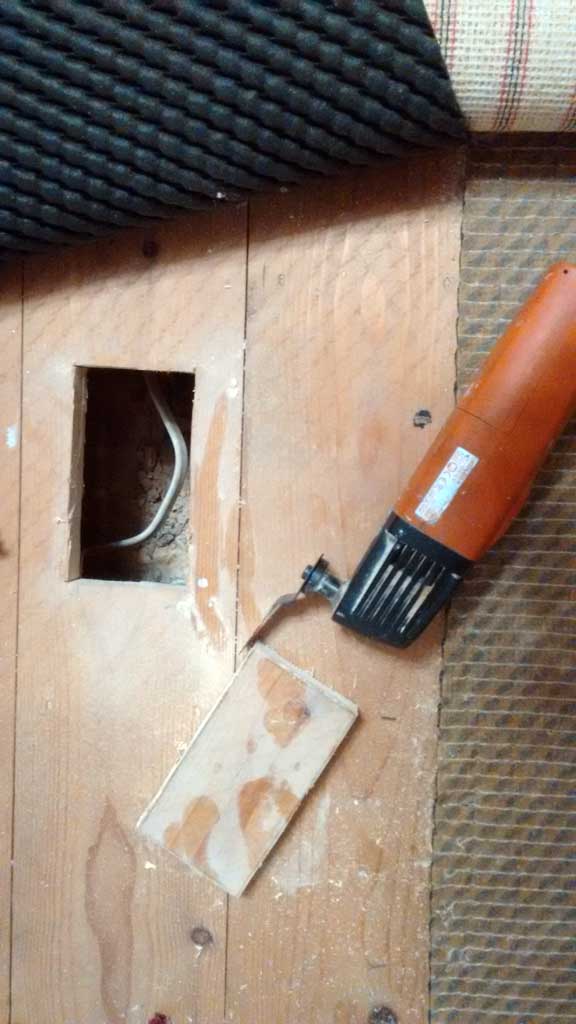
The image size is (576, 1024). What are the coordinates of `carpet pad` in the screenshot? It's located at [x=276, y=147].